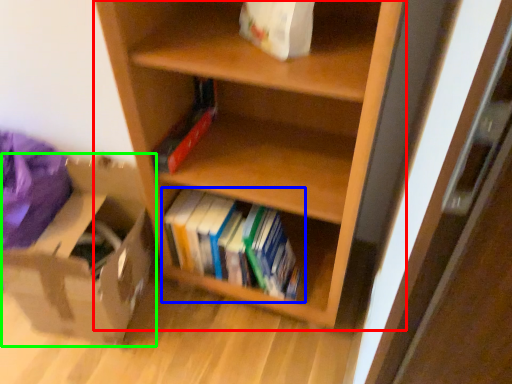
Question: Based on their relative distances, which object is nearer to shelf (highlighted by a red box)? Choose from book (highlighted by a blue box) and cardboard box (highlighted by a green box).

Choices:
 (A) book
 (B) cardboard box

Answer: (A)